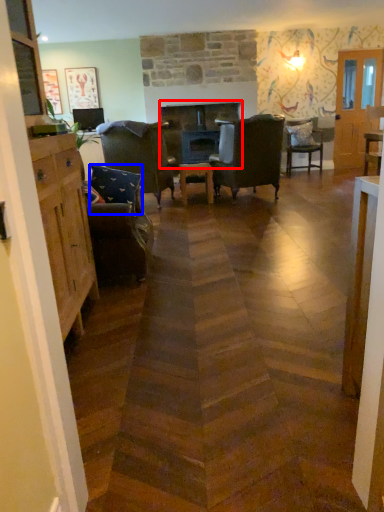
Question: Which of the following is the farthest to the observer, fireplace (highlighted by a red box) or pillow (highlighted by a blue box)?

Choices:
 (A) fireplace
 (B) pillow

Answer: (A)